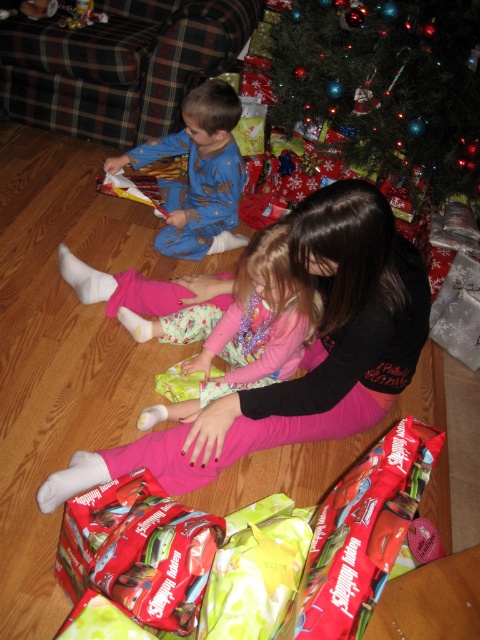
Measure the distance between green matte christmas tree at upper center and blue pajama at center.

green matte christmas tree at upper center is 21.67 inches away from blue pajama at center.

How far apart are green matte christmas tree at upper center and blue pajama at center?

green matte christmas tree at upper center is 21.67 inches away from blue pajama at center.

Which is in front, point (468, 56) or point (237, 214)?

Point (468, 56) is more forward.

Image resolution: width=480 pixels, height=640 pixels. Find the location of `green matte christmas tree at upper center`. green matte christmas tree at upper center is located at coordinates (386, 84).

Is pink matte/black sweater at center closer to camera compared to pink satin dress at center?

Yes, it is.

Where is `pink matte/black sweater at center`? pink matte/black sweater at center is located at coordinates (302, 356).

Does point (108, 460) come behind point (267, 227)?

Yes, point (108, 460) is behind point (267, 227).

The height and width of the screenshot is (640, 480). I want to click on pink matte/black sweater at center, so click(302, 356).

Who is positioned more to the right, pink matte/black sweater at center or blue pajama at center?

pink matte/black sweater at center is more to the right.

Between pink matte/black sweater at center and blue pajama at center, which one appears on the left side from the viewer's perspective?

blue pajama at center is more to the left.

Does point (219, 433) lie behind point (164, 182)?

No, (219, 433) is in front of (164, 182).

Identify the location of pink matte/black sweater at center. (302, 356).